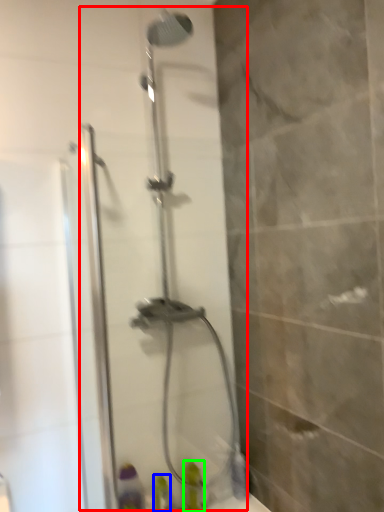
Question: Which object is the farthest from shower door (highlighted by a red box)? Choose among these: toiletry (highlighted by a blue box) or toiletry (highlighted by a green box).

Choices:
 (A) toiletry
 (B) toiletry

Answer: (A)